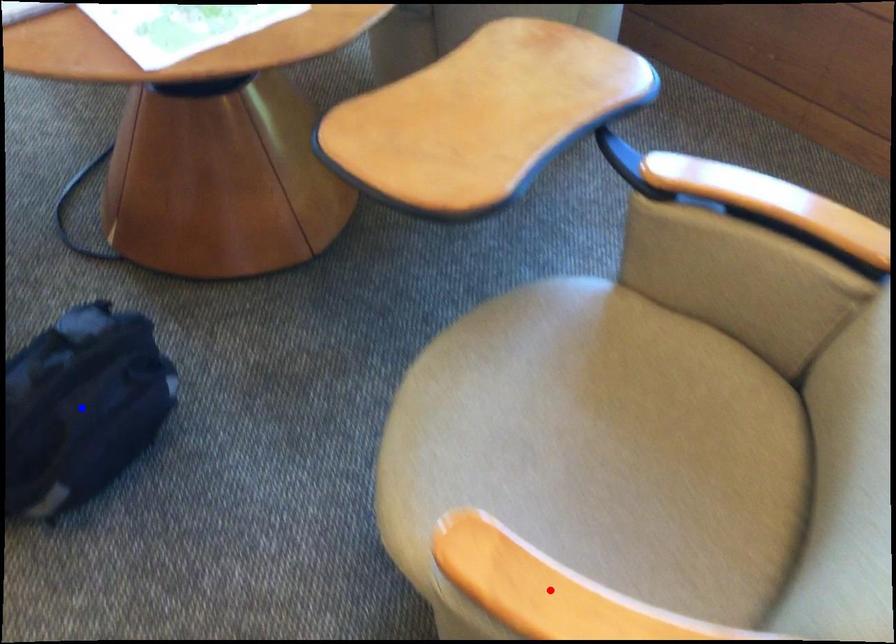
Question: Two points are marked on the image. Which point is closer to the camera?

Choices:
 (A) Blue point is closer.
 (B) Red point is closer.

Answer: (B)